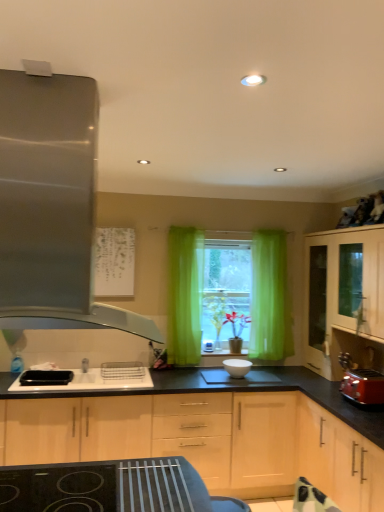
Image resolution: width=384 pixels, height=512 pixels. I want to click on free spot below green sheer curtain at center (from a real-world perspective), so click(x=192, y=362).